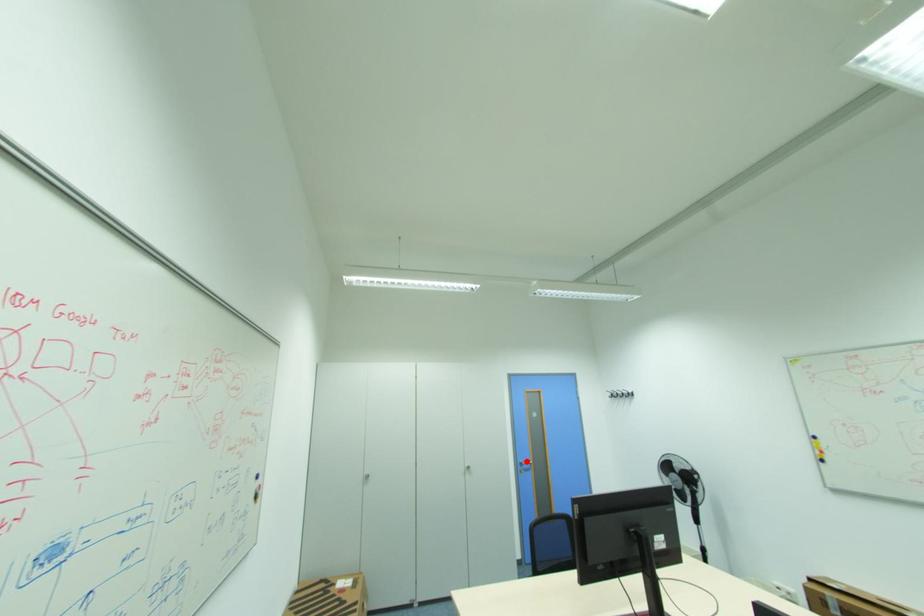
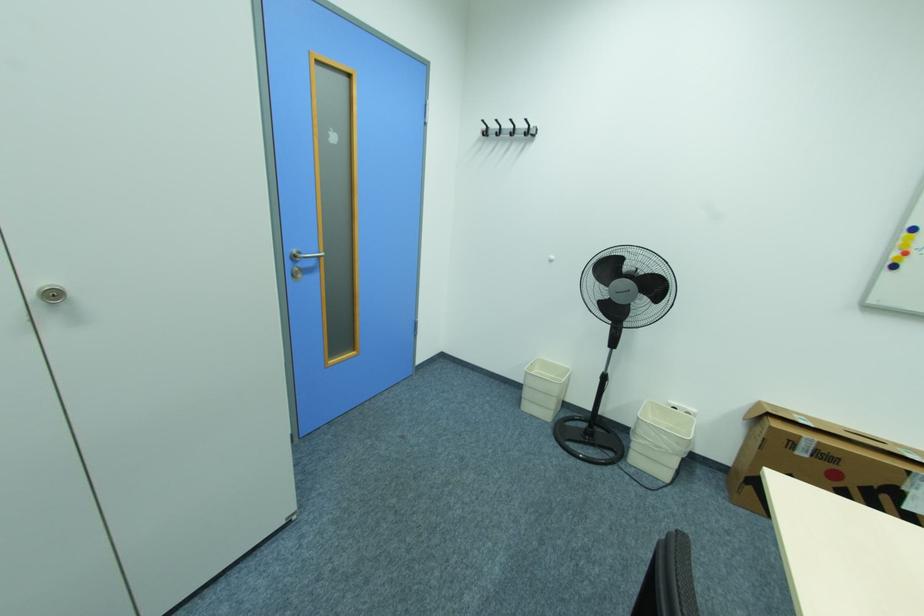
Where in the second image is the point corresponding to the highlighted location from the first image?

(300, 252)